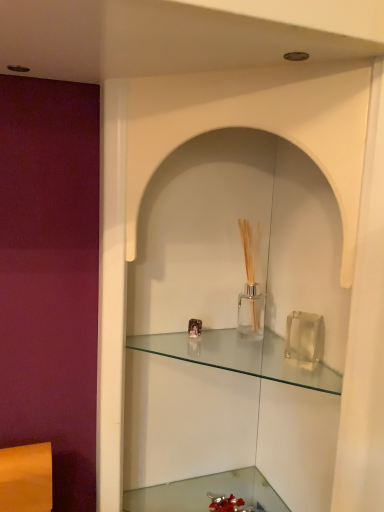
Question: From their relative heights in the image, would you say clear glass shelf at center is taller or shorter than clear glass vase at lower center?

Choices:
 (A) short
 (B) tall

Answer: (A)

Question: Considering the positions of clear glass shelf at center and clear glass vase at lower center in the image, is clear glass shelf at center bigger or smaller than clear glass vase at lower center?

Choices:
 (A) big
 (B) small

Answer: (B)

Question: Considering their positions, is clear glass shelf at center located in front of or behind clear glass vase at lower center?

Choices:
 (A) front
 (B) behind

Answer: (A)

Question: Looking at the image, does clear glass vase at lower center seem bigger or smaller compared to clear glass shelf at center?

Choices:
 (A) big
 (B) small

Answer: (A)

Question: Is clear glass vase at lower center to the left or to the right of clear glass shelf at center in the image?

Choices:
 (A) left
 (B) right

Answer: (A)

Question: In terms of width, does clear glass vase at lower center look wider or thinner when compared to clear glass shelf at center?

Choices:
 (A) wide
 (B) thin

Answer: (A)

Question: Which is correct: clear glass vase at lower center is inside clear glass shelf at center, or outside of it?

Choices:
 (A) inside
 (B) outside

Answer: (B)